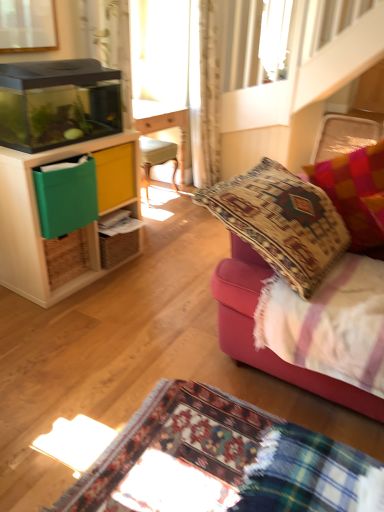
This screenshot has height=512, width=384. In order to click on multicolored woven pillow at right in this screenshot , I will do `click(356, 193)`.

This screenshot has width=384, height=512. Describe the element at coordinates (39, 219) in the screenshot. I see `matte wood cabinet at left` at that location.

You are a GUI agent. You are given a task and a screenshot of the screen. Output one action in this format:
    pyautogui.click(x=<x>, y=<y>)
    Task: Click on the velvet cushion at right
    The width and height of the screenshot is (384, 512).
    Given the screenshot: What is the action you would take?
    pyautogui.click(x=253, y=327)

Identify the location of light beige textured curtain at upper center. The width and height of the screenshot is (384, 512). (204, 93).

From a real-world perspective, who is located higher, light beige textured curtain at upper center or velvet cushion at right?

light beige textured curtain at upper center.

The height and width of the screenshot is (512, 384). Find the location of `studio couch on the right of the light beige textured curtain at upper center`. studio couch on the right of the light beige textured curtain at upper center is located at coordinates (253, 327).

From the image's perspective, is light beige textured curtain at upper center beneath velvet cushion at right?

No, from the image's perspective, light beige textured curtain at upper center is not beneath velvet cushion at right.

Considering the relative sizes of light beige textured curtain at upper center and velvet cushion at right in the image provided, is light beige textured curtain at upper center thinner than velvet cushion at right?

Indeed, light beige textured curtain at upper center has a lesser width compared to velvet cushion at right.

Considering the positions of objects matte wood cabinet at left and multicolored woven pillow at right in the image provided, who is more to the left, matte wood cabinet at left or multicolored woven pillow at right?

From the viewer's perspective, matte wood cabinet at left appears more on the left side.

From the image's perspective, which object appears higher, matte wood cabinet at left or multicolored woven pillow at right?

multicolored woven pillow at right, from the image's perspective.

Is point (87, 238) positioned before point (374, 165)?

That is False.

Would you say matte wood cabinet at left is inside or outside multicolored woven pillow at right?

matte wood cabinet at left cannot be found inside multicolored woven pillow at right.

Can you confirm if matte wood cabinet at left is smaller than light beige textured curtain at upper center?

Incorrect, matte wood cabinet at left is not smaller in size than light beige textured curtain at upper center.

Is there a large distance between matte wood cabinet at left and light beige textured curtain at upper center?

matte wood cabinet at left is far away from light beige textured curtain at upper center.

Is matte wood cabinet at left to the right of light beige textured curtain at upper center from the viewer's perspective?

In fact, matte wood cabinet at left is to the left of light beige textured curtain at upper center.

Is light beige textured curtain at upper center placed right next to matte wood cabinet at left?

No, light beige textured curtain at upper center is not making contact with matte wood cabinet at left.

Is light beige textured curtain at upper center shorter than matte wood cabinet at left?

In fact, light beige textured curtain at upper center may be taller than matte wood cabinet at left.

Considering the sizes of objects light beige textured curtain at upper center and matte wood cabinet at left in the image provided, who is bigger, light beige textured curtain at upper center or matte wood cabinet at left?

Bigger between the two is matte wood cabinet at left.

Which is behind, light beige textured curtain at upper center or matte wood cabinet at left?

light beige textured curtain at upper center is more distant.

Does light beige textured curtain at upper center come behind multicolored woven pillow at right?

Yes.

Is point (212, 42) positioned in front of point (379, 226)?

That is False.

Can multicolored woven pillow at right be found inside light beige textured curtain at upper center?

No, multicolored woven pillow at right is not surrounded by light beige textured curtain at upper center.

Is light beige textured curtain at upper center in contact with multicolored woven pillow at right?

No, light beige textured curtain at upper center is not with multicolored woven pillow at right.

Is velvet cushion at right positioned far away from light beige textured curtain at upper center?

Indeed, velvet cushion at right is not near light beige textured curtain at upper center.

Is velvet cushion at right oriented towards light beige textured curtain at upper center?

No, velvet cushion at right is not oriented towards light beige textured curtain at upper center.

Is velvet cushion at right taller or shorter than light beige textured curtain at upper center?

Clearly, velvet cushion at right is shorter compared to light beige textured curtain at upper center.

Locate an element on the screen. The width and height of the screenshot is (384, 512). studio couch in front of the light beige textured curtain at upper center is located at coordinates (253, 327).

From the image's perspective, which object appears higher, velvet cushion at right or matte wood cabinet at left?

From the image's view, matte wood cabinet at left is above.

Between velvet cushion at right and matte wood cabinet at left, which one has larger size?

With larger size is velvet cushion at right.

Measure the distance from velvet cushion at right to matte wood cabinet at left.

velvet cushion at right is 1.03 meters away from matte wood cabinet at left.

Is velvet cushion at right far from matte wood cabinet at left?

velvet cushion at right is positioned a significant distance from matte wood cabinet at left.

In the image, there is a light beige textured curtain at upper center. At what (x,y) coordinates should I click in order to perform the action: click on studio couch below it (from the image's perspective). Please return your answer as a coordinate pair (x, y). Looking at the image, I should click on (253, 327).

In the image, there is a multicolored woven pillow at right. Where is `cabinetry below it (from a real-world perspective)`? This screenshot has height=512, width=384. cabinetry below it (from a real-world perspective) is located at coordinates (39, 219).

Which object lies nearer to the anchor point velvet cushion at right, multicolored woven pillow at right or matte wood cabinet at left?

multicolored woven pillow at right is closer to velvet cushion at right.

When comparing their distances from matte wood cabinet at left, does light beige textured curtain at upper center or multicolored woven pillow at right seem further?

light beige textured curtain at upper center lies further to matte wood cabinet at left than the other object.

When comparing their distances from matte wood cabinet at left, does multicolored woven pillow at right or light beige textured curtain at upper center seem closer?

Among the two, multicolored woven pillow at right is located nearer to matte wood cabinet at left.

Consider the image. When comparing their distances from multicolored woven pillow at right, does velvet cushion at right or matte wood cabinet at left seem further?

matte wood cabinet at left is further to multicolored woven pillow at right.

From the image, which object appears to be farther from velvet cushion at right, matte wood cabinet at left or multicolored woven pillow at right?

matte wood cabinet at left is positioned further to the anchor velvet cushion at right.

Looking at the image, which one is located closer to matte wood cabinet at left, velvet cushion at right or light beige textured curtain at upper center?

velvet cushion at right lies closer to matte wood cabinet at left than the other object.

Considering their positions, is light beige textured curtain at upper center positioned closer to velvet cushion at right than multicolored woven pillow at right?

Among the two, multicolored woven pillow at right is located nearer to velvet cushion at right.

Considering their positions, is multicolored woven pillow at right positioned further to light beige textured curtain at upper center than matte wood cabinet at left?

multicolored woven pillow at right.

Identify the location of cabinetry positioned between multicolored woven pillow at right and light beige textured curtain at upper center from near to far. (39, 219).

Find the location of a particular element. The image size is (384, 512). cabinetry positioned between velvet cushion at right and light beige textured curtain at upper center from near to far is located at coordinates (39, 219).

The height and width of the screenshot is (512, 384). Identify the location of pillow between velvet cushion at right and light beige textured curtain at upper center along the z-axis. (356, 193).

Identify the location of studio couch located between matte wood cabinet at left and multicolored woven pillow at right in the left-right direction. The image size is (384, 512). (253, 327).